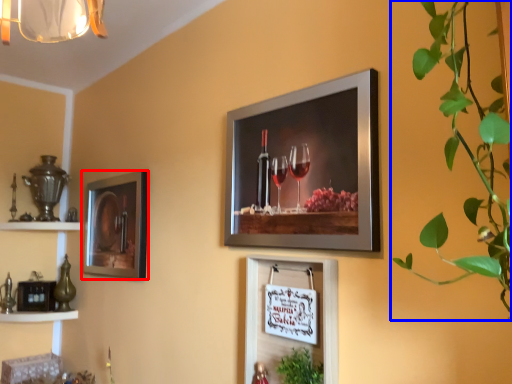
Question: Among these objects, which one is farthest to the camera, picture frame (highlighted by a red box) or houseplant (highlighted by a blue box)?

Choices:
 (A) picture frame
 (B) houseplant

Answer: (A)